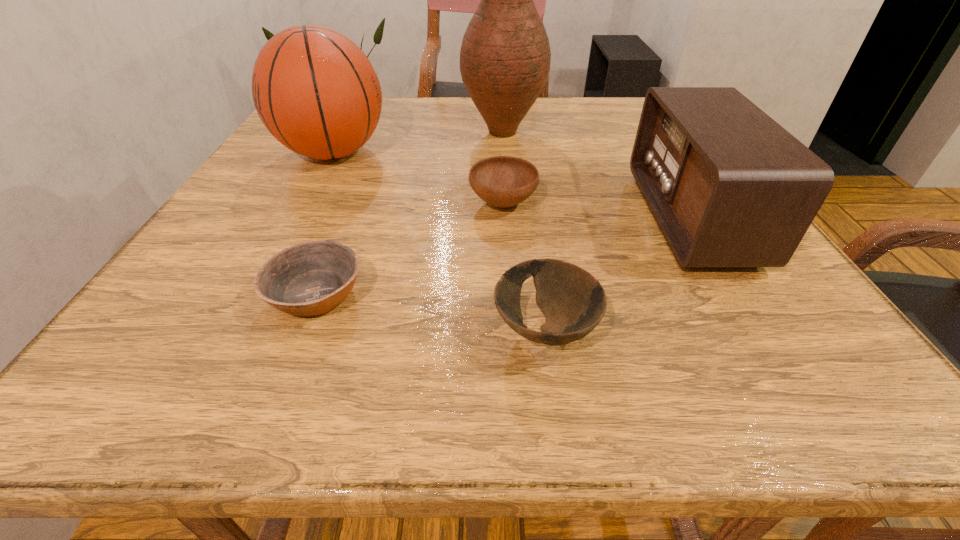
This screenshot has width=960, height=540. What are the coordinates of `vacant space situated on the front-facing side of the fourth shortest object` in the screenshot? It's located at (472, 218).

At what (x,y) coordinates should I click in order to perform the action: click on vacant space situated 0.200m on the front-facing side of the fourth shortest object. Please return your answer as a coordinate pair (x, y). The height and width of the screenshot is (540, 960). Looking at the image, I should click on (542, 218).

Identify the location of vacant space located 0.240m on the left of the farthest bowl. The height and width of the screenshot is (540, 960). (346, 204).

The width and height of the screenshot is (960, 540). I want to click on vacant space located on the back of the shortest bowl, so click(x=340, y=234).

Find the location of a particular element. vase located at the far edge is located at coordinates (505, 56).

Locate an element on the screen. basketball located at the far edge is located at coordinates (314, 89).

The image size is (960, 540). Find the location of `object situated at the near edge`. object situated at the near edge is located at coordinates (573, 302).

Where is `object that is positioned at the left edge`? This screenshot has width=960, height=540. object that is positioned at the left edge is located at coordinates (314, 89).

Where is `object located in the right edge section of the desktop`? This screenshot has width=960, height=540. object located in the right edge section of the desktop is located at coordinates (729, 187).

At what (x,y) coordinates should I click in order to perform the action: click on object located in the far left corner section of the desktop. Please return your answer as a coordinate pair (x, y). The height and width of the screenshot is (540, 960). Looking at the image, I should click on click(x=314, y=89).